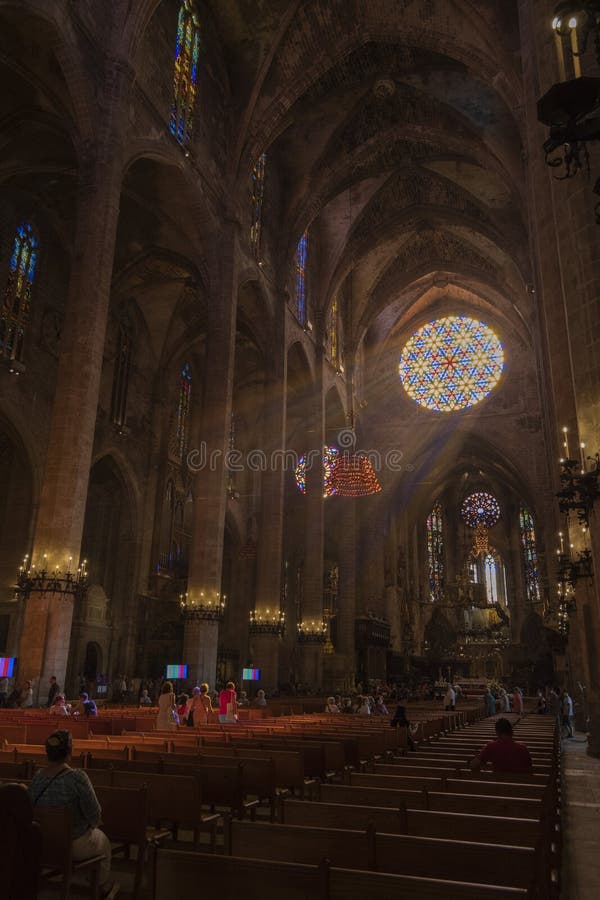
Find the location of `circular stained glass windows`. circular stained glass windows is located at coordinates (490, 497), (453, 353).